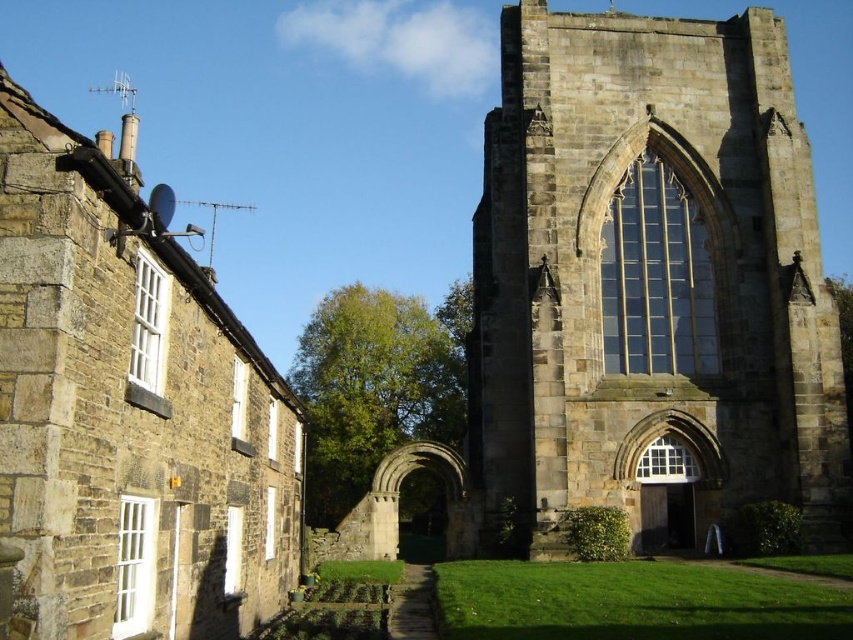
Can you confirm if stone gothic tower at center is taller than stone church at upper center?

No, stone gothic tower at center is not taller than stone church at upper center.

Can you confirm if stone gothic tower at center is positioned above stone church at upper center?

Actually, stone gothic tower at center is below stone church at upper center.

The width and height of the screenshot is (853, 640). What are the coordinates of `stone gothic tower at center` in the screenshot? It's located at (650, 282).

Locate an element on the screen. stone gothic tower at center is located at coordinates (650, 282).